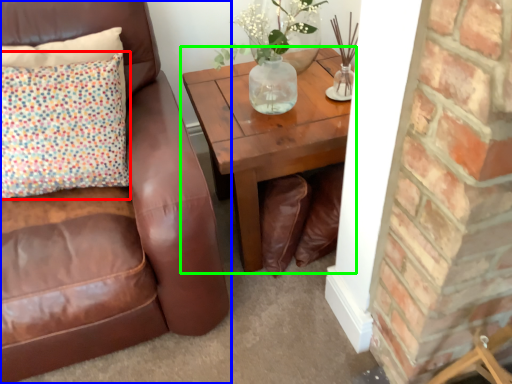
Question: Based on their relative distances, which object is nearer to pillow (highlighted by a red box)? Choose from chair (highlighted by a blue box) and coffee table (highlighted by a green box).

Choices:
 (A) chair
 (B) coffee table

Answer: (A)